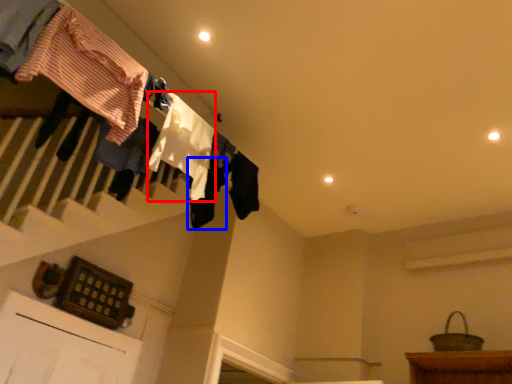
Question: Which of the following is the farthest to the observer, clothing (highlighted by a red box) or clothing (highlighted by a blue box)?

Choices:
 (A) clothing
 (B) clothing

Answer: (B)